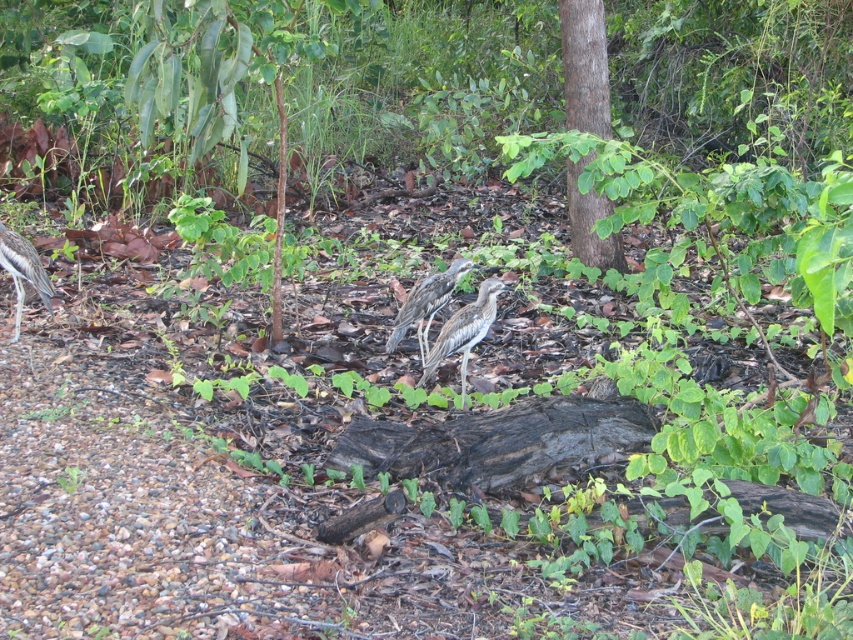
You are a hiker who wants to place a small marker at point (584, 67). According to the scene, what object will the marker be placed on?

The marker will be placed on the smooth brown tree at center located at point (584, 67).

You are a hiker trying to decide whether to place a small 10cm wide container between the smooth brown tree at center and the speckled feathered bird at center. Based on their widths, can the container fit between them without touching either?

The smooth brown tree at center might be wider than the speckled feathered bird at center, so the container might not fit between them if the tree is wider. However, since the exact width of the tree isn

You are standing in a forest area and want to take a photo of the point at coordinate point (x=432, y=276). The camera you have can focus on objects within 15 feet. Will the point be in focus?

The distance of point (x=432, y=276) from the camera is 13.88 feet, which is within the camera focus range of 15 feet. Therefore, the point will be in focus.